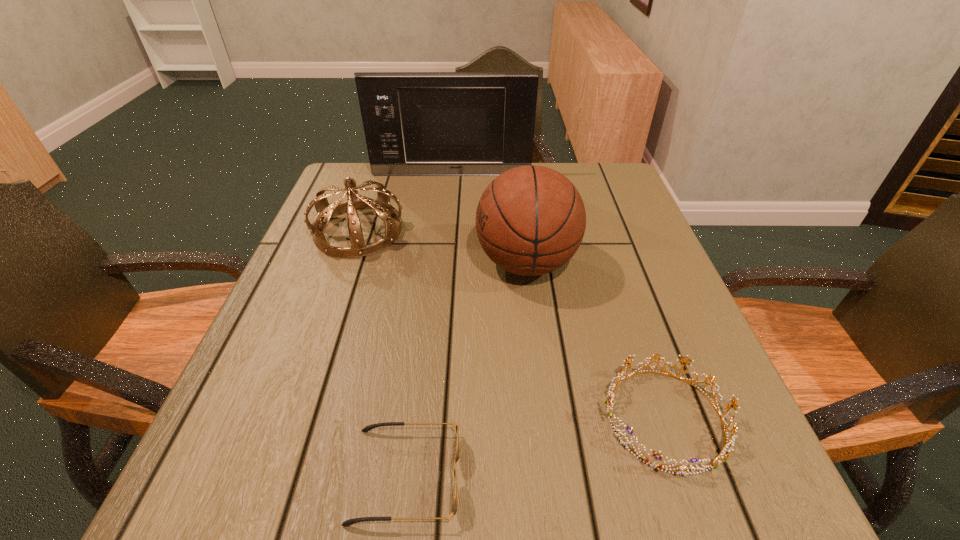
Locate an element on the screen. The image size is (960, 540). vacant point located between the farther tiara and the fourth shortest object is located at coordinates (443, 247).

Where is `free spot between the sunglasses and the microwave oven`? The height and width of the screenshot is (540, 960). free spot between the sunglasses and the microwave oven is located at coordinates (428, 325).

Image resolution: width=960 pixels, height=540 pixels. Identify the location of object identified as the closest to the third shortest object. (416, 123).

Find the location of `object that ranks as the closest to the third shortest object`. object that ranks as the closest to the third shortest object is located at coordinates (416, 123).